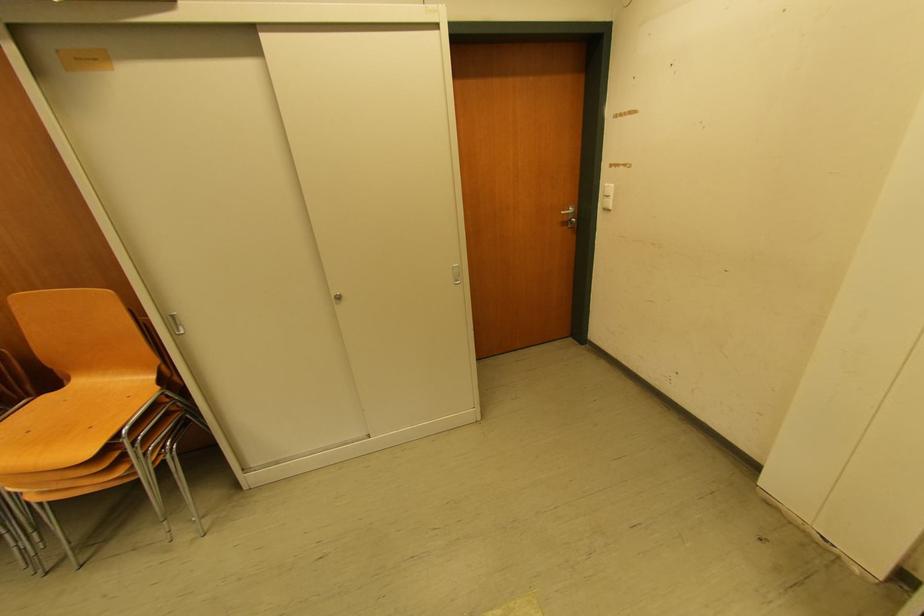
You are a GUI agent. You are given a task and a screenshot of the screen. Output one action in this format:
    pyautogui.click(x=<x>, y=<y>)
    Task: Click on the metal door handle
    
    Given the screenshot: What is the action you would take?
    pyautogui.click(x=568, y=209)